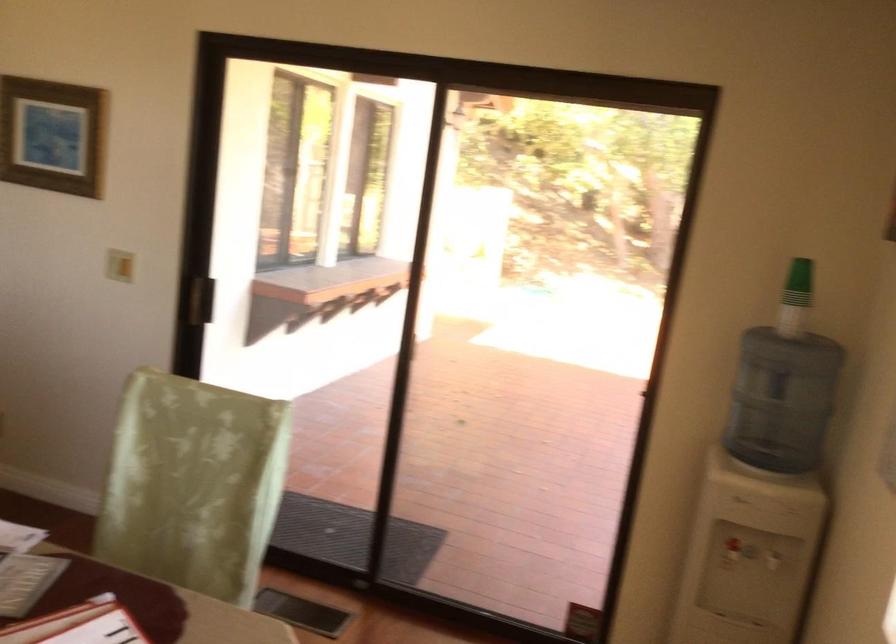
Where would you sit the light green chair sitting surface? Please return your answer as a coordinate pair (x, y).

(168, 565)